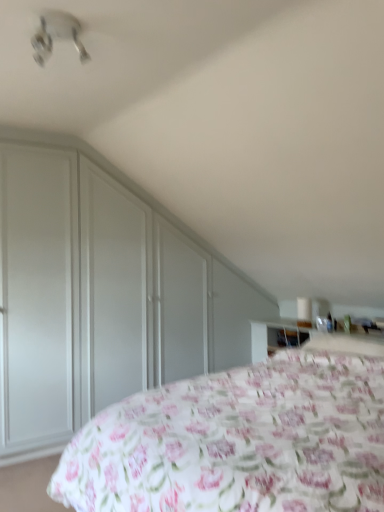
Question: Is matte white dresser at left in front of or behind floral fabric bed at lower right in the image?

Choices:
 (A) behind
 (B) front

Answer: (A)

Question: Which is correct: matte white dresser at left is inside floral fabric bed at lower right, or outside of it?

Choices:
 (A) outside
 (B) inside

Answer: (A)

Question: Which of these objects is positioned closest to the floral fabric bed at lower right?

Choices:
 (A) matte white dresser at left
 (B) white plastic fan at upper left

Answer: (A)

Question: Estimate the real-world distances between objects in this image. Which object is farther from the white plastic fan at upper left?

Choices:
 (A) matte white dresser at left
 (B) floral fabric bed at lower right

Answer: (B)